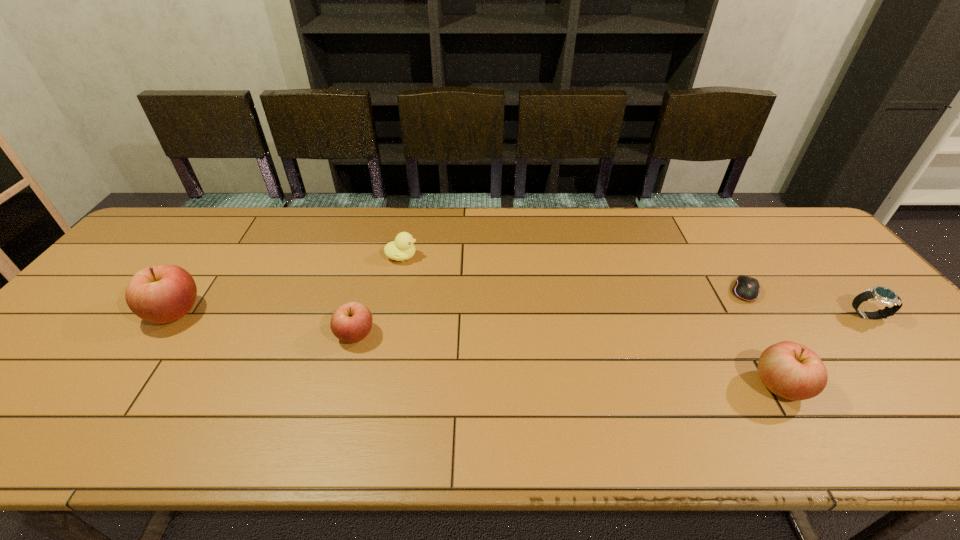
Where is `vacant region located on the back of the nearest apple`? The height and width of the screenshot is (540, 960). vacant region located on the back of the nearest apple is located at coordinates (723, 290).

At what (x,y) coordinates should I click in order to perform the action: click on free space located 0.150m at the beak of the farthest object. Please return your answer as a coordinate pair (x, y). This screenshot has height=540, width=960. Looking at the image, I should click on (468, 256).

Locate an element on the screen. Image resolution: width=960 pixels, height=540 pixels. free region located on the front of the rightmost object is located at coordinates (940, 398).

I want to click on free region located 0.370m on the back of the shortest object, so pyautogui.click(x=691, y=207).

The height and width of the screenshot is (540, 960). In order to click on object at the far edge in this screenshot , I will do `click(401, 249)`.

Where is `object situated at the near edge`? object situated at the near edge is located at coordinates (790, 370).

You are a GUI agent. You are given a task and a screenshot of the screen. Output one action in this format:
    pyautogui.click(x=<x>, y=<y>)
    Task: Click on the object at the right edge
    The height and width of the screenshot is (540, 960).
    Given the screenshot: What is the action you would take?
    pyautogui.click(x=883, y=295)

At what (x,y) coordinates should I click in order to perform the action: click on vacant region at the far edge. Please return your answer as a coordinate pair (x, y). This screenshot has width=960, height=540. Looking at the image, I should click on (753, 233).

Locate an element on the screen. The image size is (960, 540). vacant space at the near edge of the desktop is located at coordinates (420, 397).

At what (x,y) coordinates should I click in order to perform the action: click on free space at the right edge of the desktop. Please return your answer as a coordinate pair (x, y). Looking at the image, I should click on (854, 298).